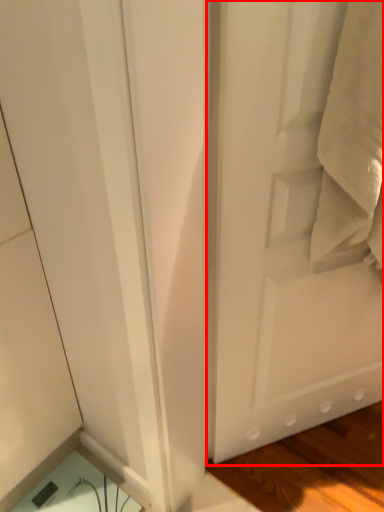
Question: From the image's perspective, considering the relative positions of door (annotated by the red box) and bath towel in the image provided, where is door (annotated by the red box) located with respect to the staircase?

Choices:
 (A) above
 (B) below

Answer: (B)